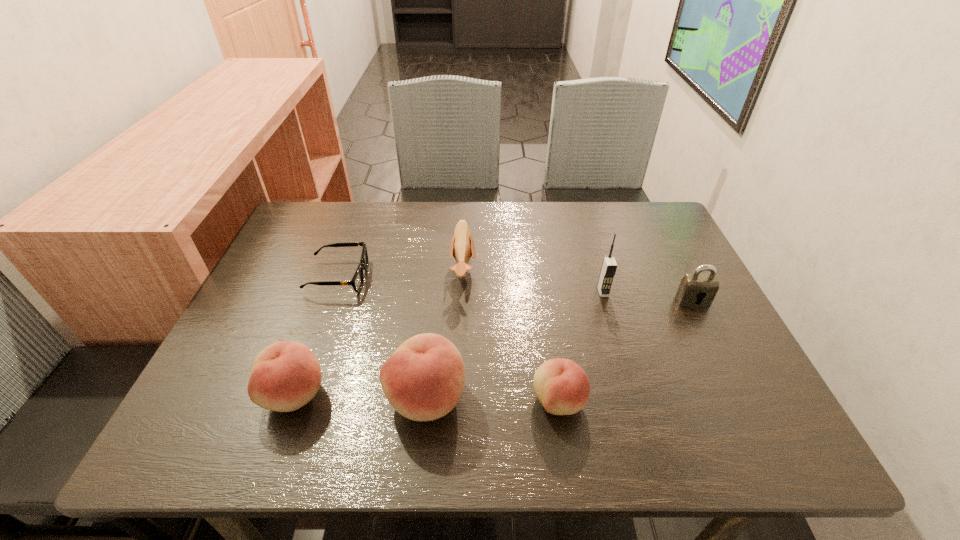
You are a GUI agent. You are given a task and a screenshot of the screen. Output one action in this format:
    pyautogui.click(x=<x>, y=<y>)
    Task: Click on the object located in the near left corner section of the desktop
    
    Given the screenshot: What is the action you would take?
    pyautogui.click(x=286, y=375)

Image resolution: width=960 pixels, height=540 pixels. In order to click on vacant region at the far edge of the desktop in this screenshot , I will do `click(370, 204)`.

Identify the location of vacant space at the near edge of the desktop. (506, 403).

You are a GUI agent. You are given a task and a screenshot of the screen. Output one action in this format:
    pyautogui.click(x=<x>, y=<y>)
    Task: Click on the free region at the left edge of the desktop
    
    Given the screenshot: What is the action you would take?
    pyautogui.click(x=277, y=293)

Find the location of a particular element. vacant region at the right edge of the desktop is located at coordinates (716, 314).

What are the coordinates of `vacant space at the far left corner` in the screenshot? It's located at (305, 238).

This screenshot has width=960, height=540. I want to click on free location at the near right corner, so click(x=699, y=406).

I want to click on free space between the sixth object from left to right and the rightmost object, so click(x=648, y=296).

This screenshot has width=960, height=540. Find the location of `free space that is in between the sixth object from left to right and the rightmost object`. free space that is in between the sixth object from left to right and the rightmost object is located at coordinates (648, 296).

Locate an element on the screen. This screenshot has width=960, height=540. vacant area that lies between the cellular telephone and the shortest object is located at coordinates (470, 285).